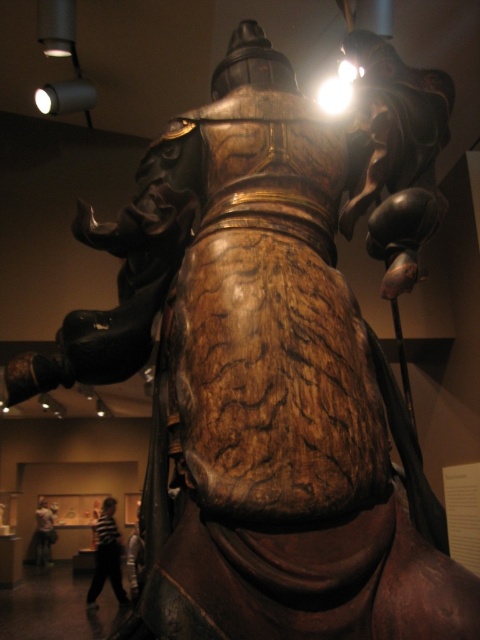
Does striped shirt at lower left have a larger size compared to white shirt at lower left?

Correct, striped shirt at lower left is larger in size than white shirt at lower left.

Looking at this image, can you confirm if striped shirt at lower left is wider than white shirt at lower left?

Yes.

Between point (108, 504) and point (48, 528), which one is positioned behind?

Positioned behind is point (48, 528).

The width and height of the screenshot is (480, 640). I want to click on striped shirt at lower left, so click(x=107, y=556).